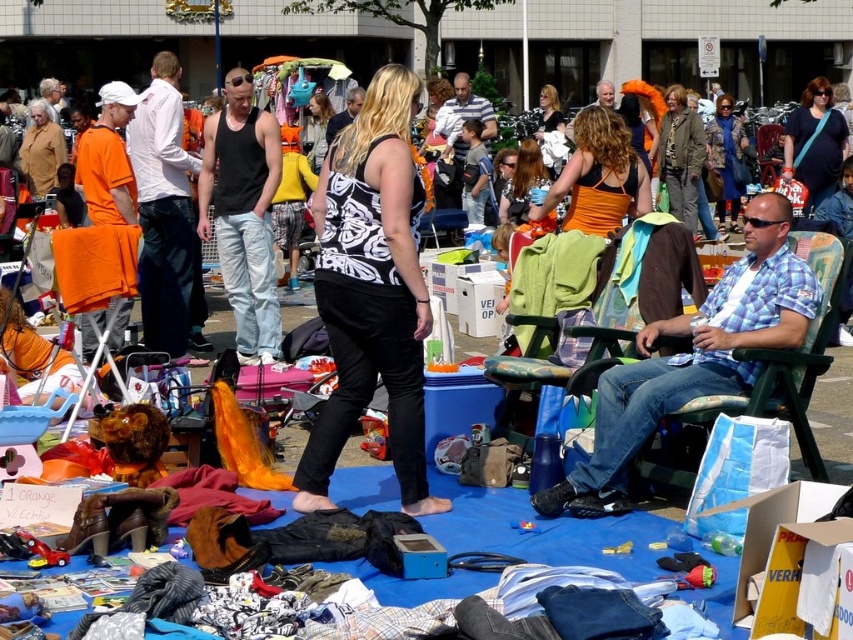
Is point (335, 170) in front of point (730, 380)?

Yes, it is.

Is black matte tank top at center below blue plaid shirt at center?

Indeed, black matte tank top at center is positioned under blue plaid shirt at center.

Image resolution: width=853 pixels, height=640 pixels. In order to click on black matte tank top at center in this screenshot , I will do `click(370, 291)`.

Does black tank top at center have a greater height compared to green fabric chair at right?

Yes.

Is point (245, 106) positioned behind point (514, 388)?

Yes, it is behind point (514, 388).

Does point (247, 253) lie in front of point (592, 298)?

No, it is not.

Identify the location of black tank top at center. This screenshot has height=640, width=853. (242, 212).

In the scene shown: Which of these two, black matte tank top at center or green fabric chair at right, stands taller?

green fabric chair at right is taller.

The height and width of the screenshot is (640, 853). Describe the element at coordinates (370, 291) in the screenshot. I see `black matte tank top at center` at that location.

Is point (323, 225) behind point (585, 252)?

That is False.

Find the location of a particular element. The width and height of the screenshot is (853, 640). black matte tank top at center is located at coordinates pyautogui.click(x=370, y=291).